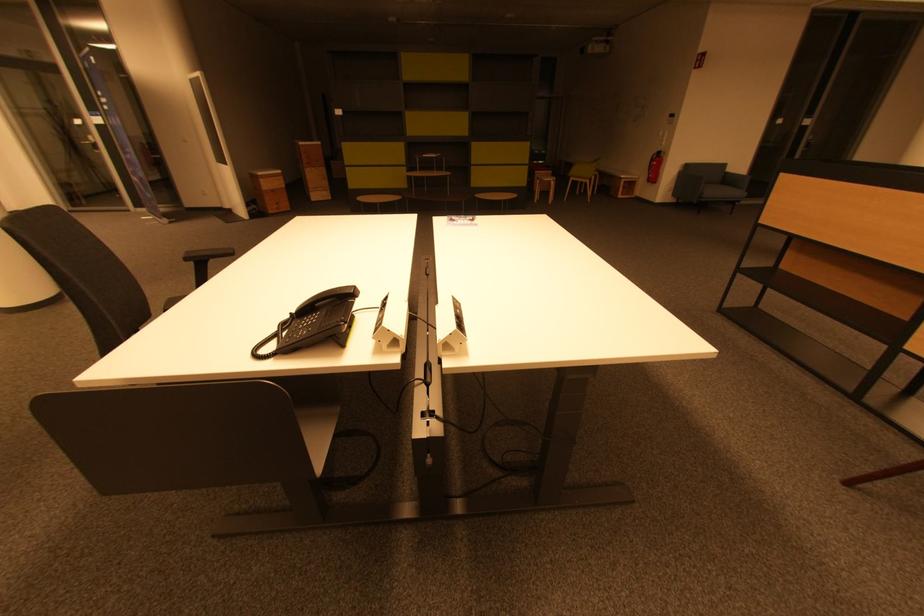
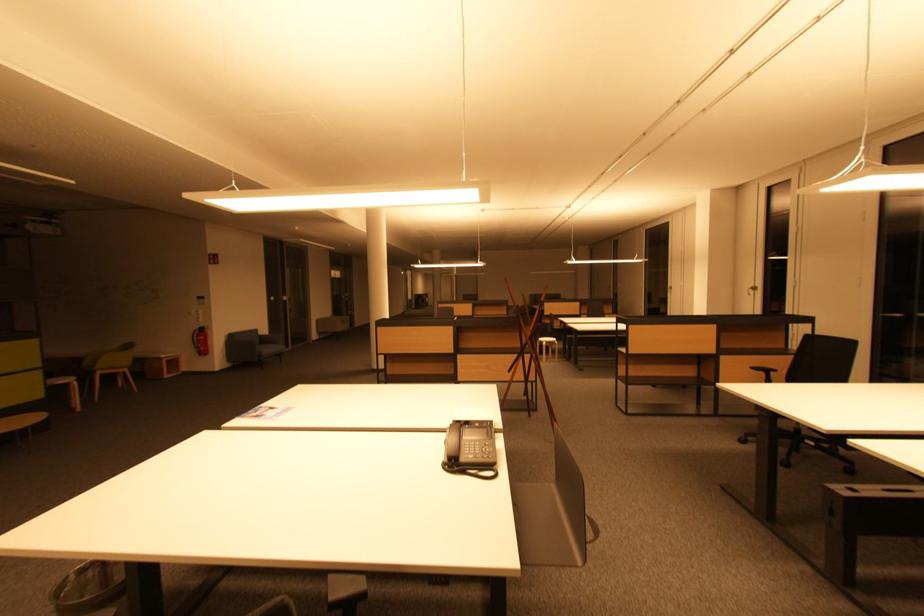
The point at (659, 180) is marked in the first image. Where is the corresponding point in the second image?

(207, 353)